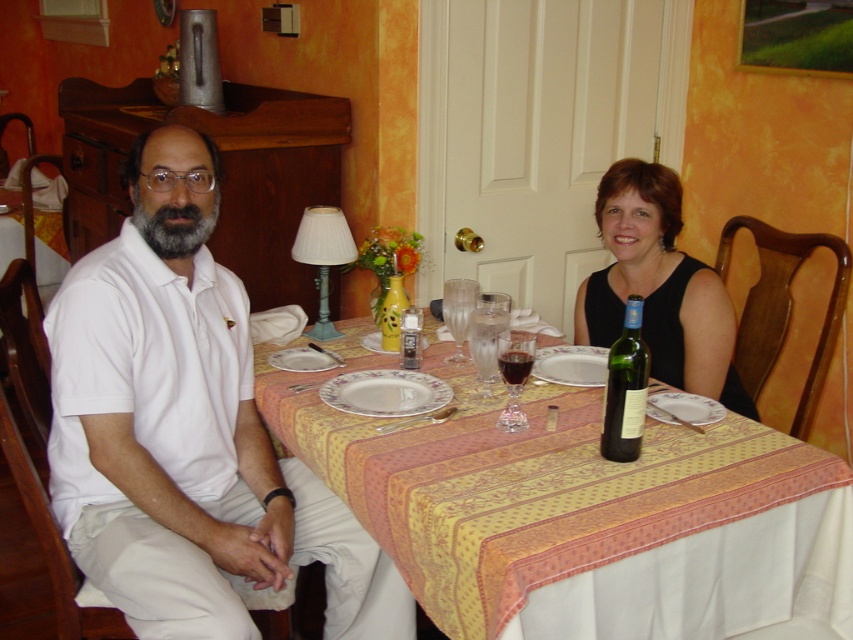
Based on the photo, you are setting up a table for a dinner party and need to place a decorative vase between two glasses. Given the transparent glass wine glass at table center and the translucent glass vase at table center, which object should you choose to ensure there is enough space between them?

The transparent glass wine glass at table center might be wider than the translucent glass vase at table center, so you should choose the translucent glass vase at table center to ensure there is enough space between them.

You are a guest at this dinner table and want to place your napkin on the yellow fabric tablecloth at center. To ensure it doesn not slide off, should you place it to the left or right of the transparent glass wine glass at center?

You should place the napkin to the left of the transparent glass wine glass at center, since the yellow fabric tablecloth at center is located to the left of the glass, meaning the area to the left is more stable and less likely to slide off.

You are a guest at this dinner table and want to reach for the green glass bottle at table center without moving your arm too far. Which direction should you move your hand from the transparent glass wine glass at table center?

The green glass bottle at table center is to the right of the transparent glass wine glass at table center, so you should move your hand to the right from the transparent glass wine glass at table center to reach the green glass bottle at table center.